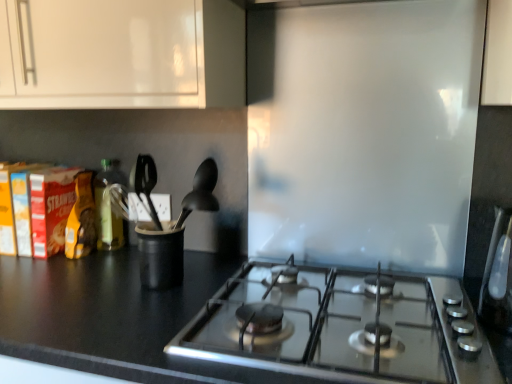
Question: From a real-world perspective, is green glass bottle at left over black matte countertop at lower left?

Choices:
 (A) no
 (B) yes

Answer: (B)

Question: Is green glass bottle at left positioned beyond the bounds of black matte countertop at lower left?

Choices:
 (A) no
 (B) yes

Answer: (B)

Question: Is green glass bottle at left bigger than black matte countertop at lower left?

Choices:
 (A) yes
 (B) no

Answer: (B)

Question: Is green glass bottle at left turned away from black matte countertop at lower left?

Choices:
 (A) no
 (B) yes

Answer: (A)

Question: Is green glass bottle at left not near black matte countertop at lower left?

Choices:
 (A) yes
 (B) no

Answer: (B)

Question: Is green glass bottle at left thinner than black matte countertop at lower left?

Choices:
 (A) yes
 (B) no

Answer: (A)

Question: Would you say green glass bottle at left is part of black matte countertop at lower left's contents?

Choices:
 (A) no
 (B) yes

Answer: (A)

Question: From the image's perspective, is black matte countertop at lower left above green glass bottle at left?

Choices:
 (A) yes
 (B) no

Answer: (B)

Question: From a real-world perspective, is black matte countertop at lower left under green glass bottle at left?

Choices:
 (A) no
 (B) yes

Answer: (B)

Question: Considering the relative sizes of black matte countertop at lower left and green glass bottle at left in the image provided, is black matte countertop at lower left shorter than green glass bottle at left?

Choices:
 (A) yes
 (B) no

Answer: (B)

Question: Is black matte countertop at lower left wider than green glass bottle at left?

Choices:
 (A) yes
 (B) no

Answer: (A)

Question: Is black matte countertop at lower left to the left of green glass bottle at left from the viewer's perspective?

Choices:
 (A) yes
 (B) no

Answer: (B)

Question: From the image's perspective, is satin silver toaster at right below green glass bottle at left?

Choices:
 (A) yes
 (B) no

Answer: (A)